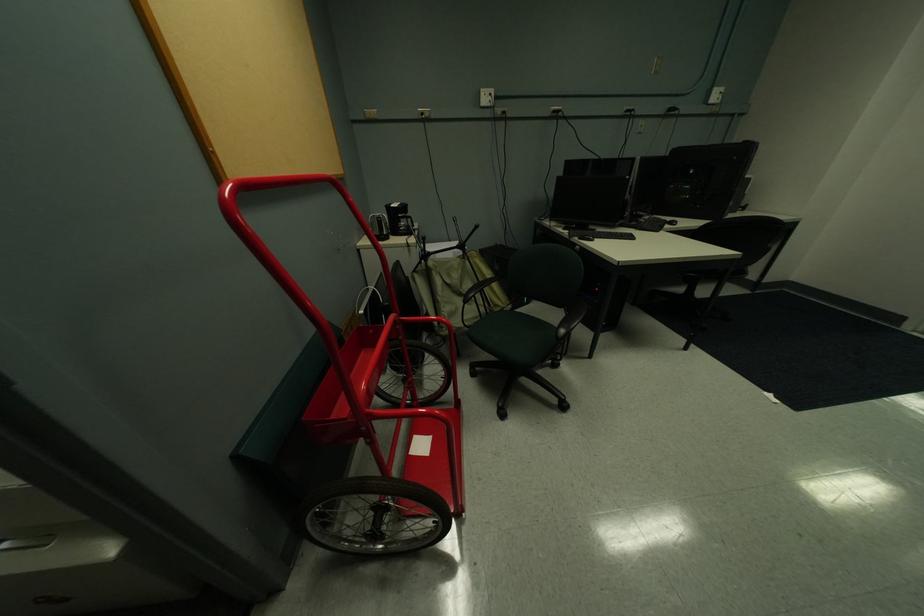
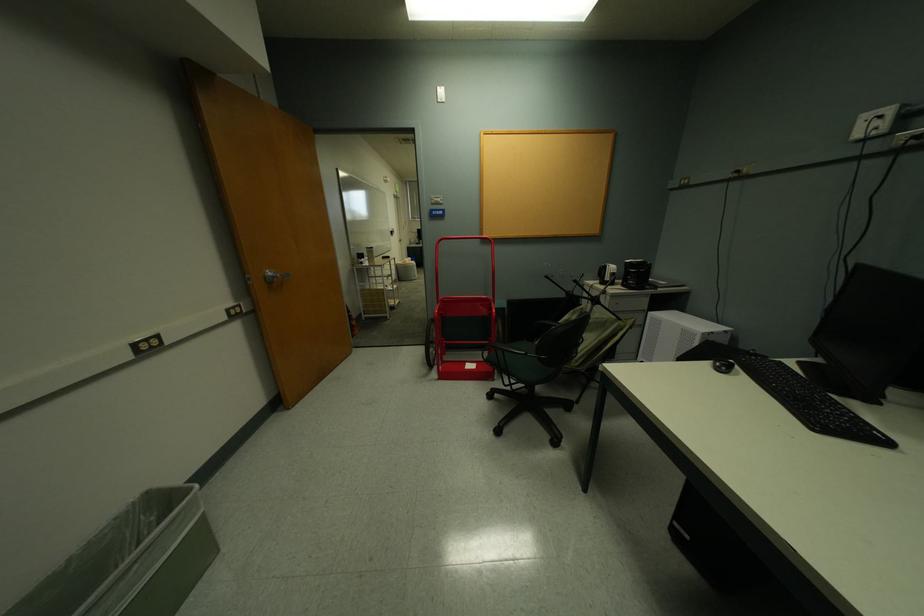
Find the pixel in the second image that matches (x=494, y=99) in the first image.

(881, 126)